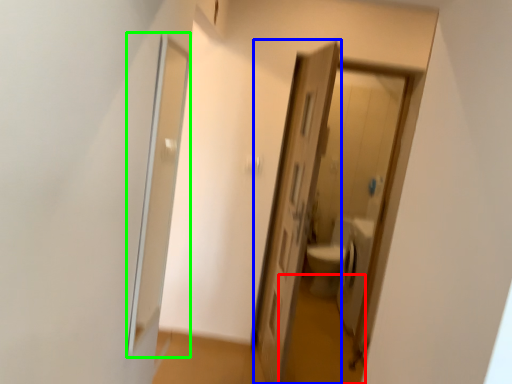
Question: Which object is the farthest from path (highlighted by a red box)? Choose among these: door (highlighted by a blue box) or screen door (highlighted by a green box).

Choices:
 (A) door
 (B) screen door

Answer: (B)